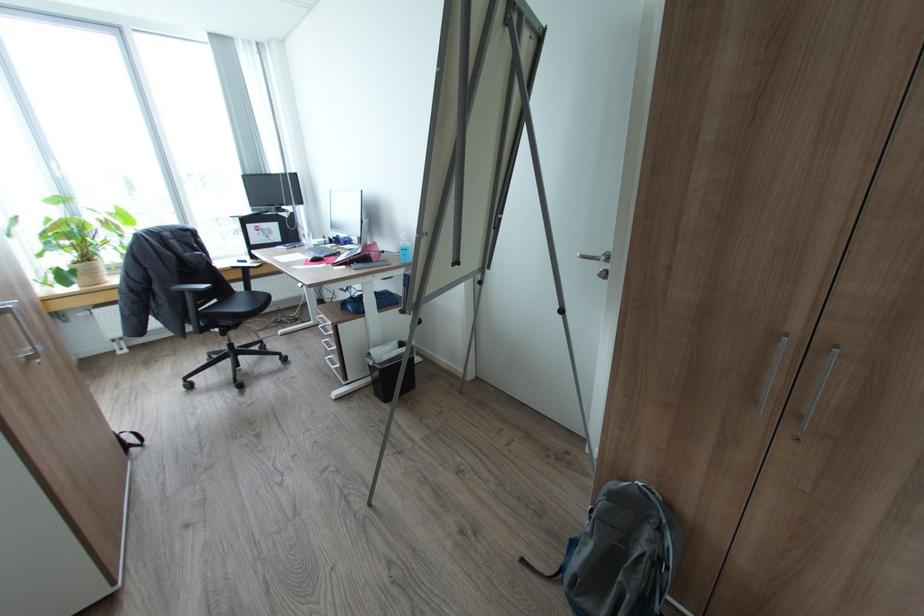
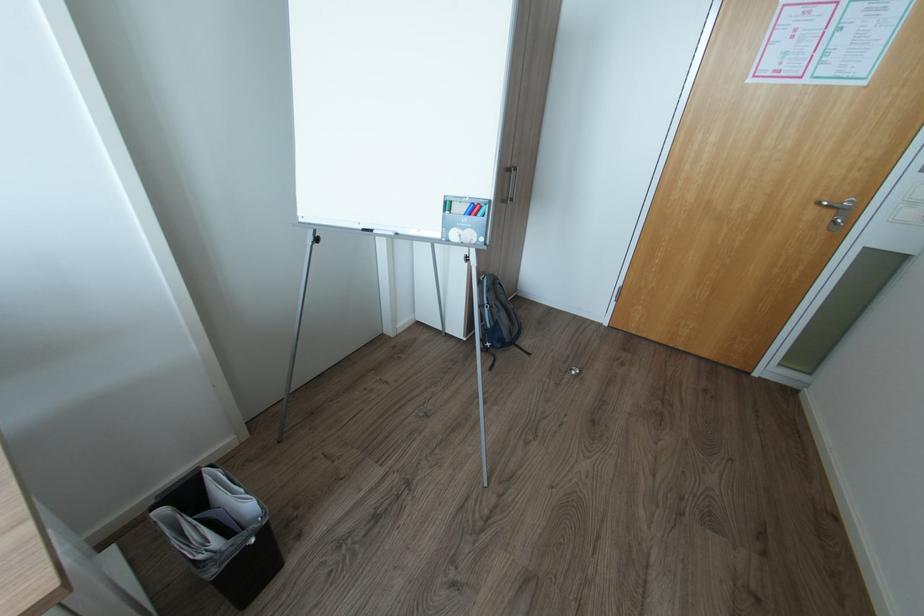
The point at (374, 363) is marked in the first image. Where is the corresponding point in the second image?

(257, 541)